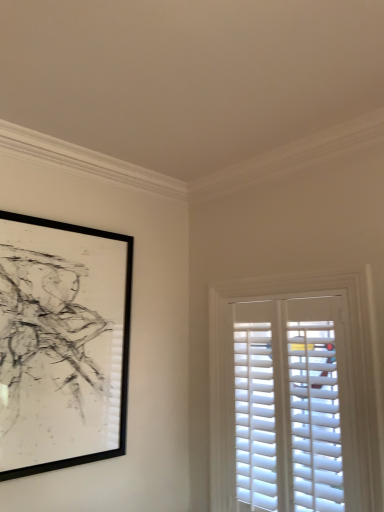
In order to click on black matte picture frame at upper left in this screenshot , I will do `click(62, 344)`.

Image resolution: width=384 pixels, height=512 pixels. What do you see at coordinates (62, 344) in the screenshot?
I see `black matte picture frame at upper left` at bounding box center [62, 344].

Based on the photo, measure the distance between point (x=106, y=377) and camera.

Point (x=106, y=377) is 6.16 feet from camera.

At what (x,y) coordinates should I click in order to perform the action: click on black matte picture frame at upper left. Please return your answer as a coordinate pair (x, y). The width and height of the screenshot is (384, 512). Looking at the image, I should click on (62, 344).